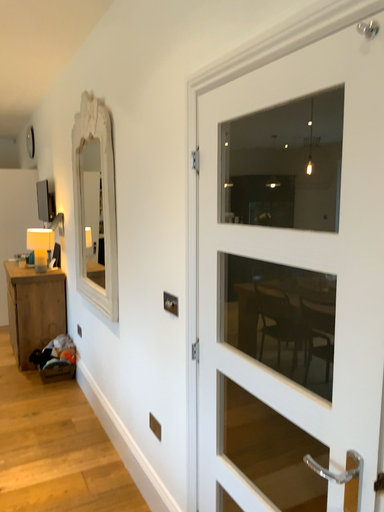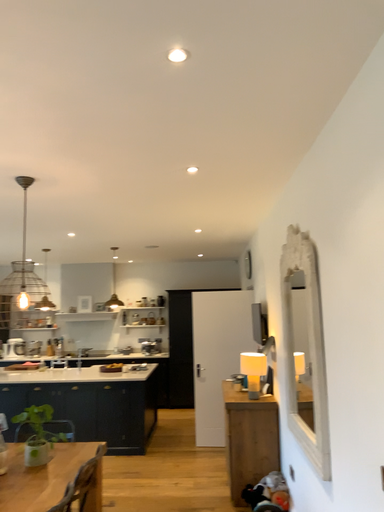
Question: Which way did the camera rotate in the video?

Choices:
 (A) rotated left
 (B) rotated right

Answer: (A)